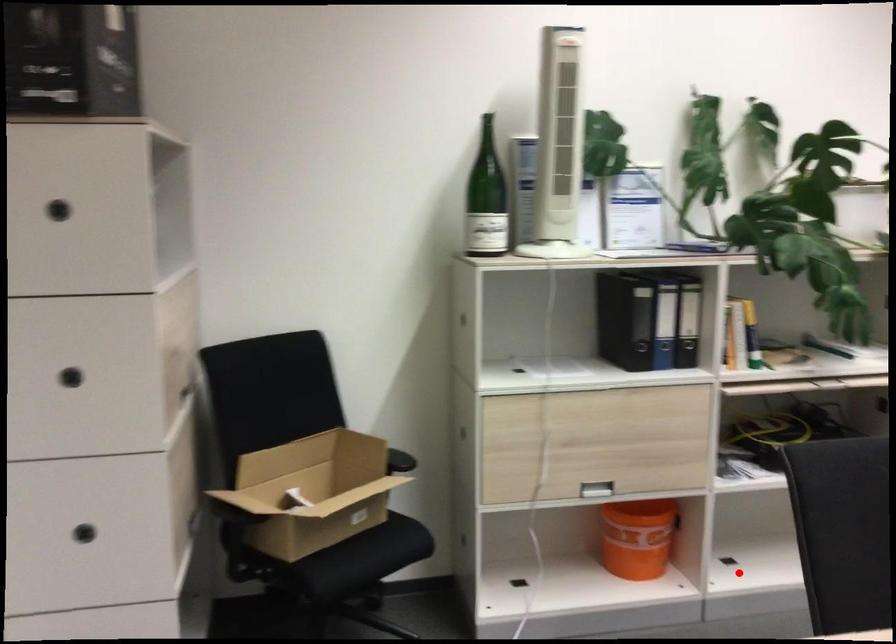
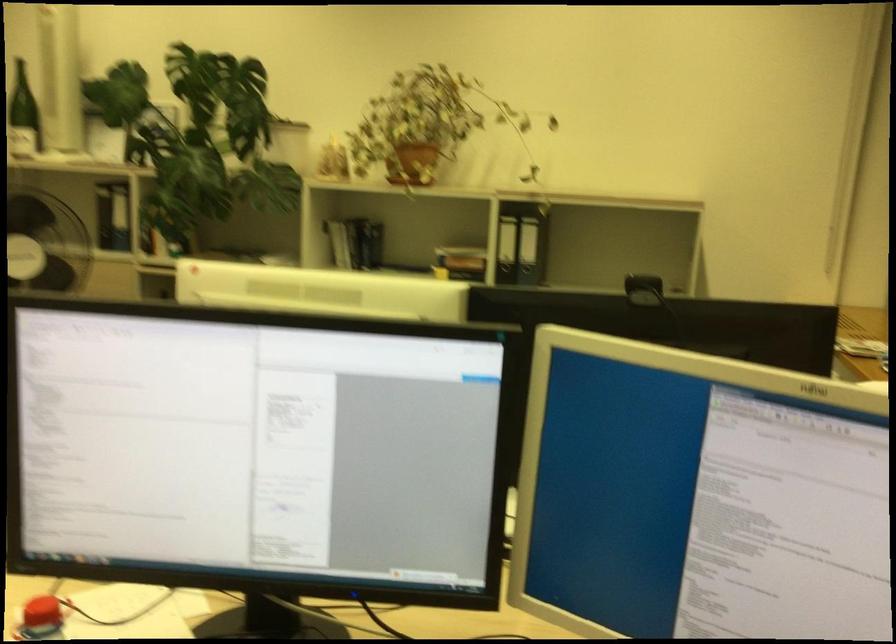
Question: I am providing you with two images of the same scene from different viewpoints. A red point is marked on the first image. Is the red point's position out of view in image 2?

Choices:
 (A) Yes
 (B) No

Answer: (A)